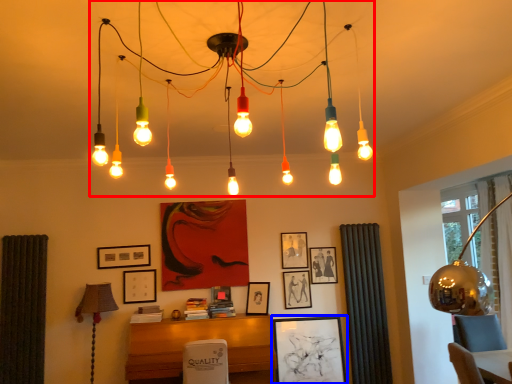
Question: Among these objects, which one is nearest to the camera, chandelier (highlighted by a red box) or picture frame (highlighted by a blue box)?

Choices:
 (A) chandelier
 (B) picture frame

Answer: (A)